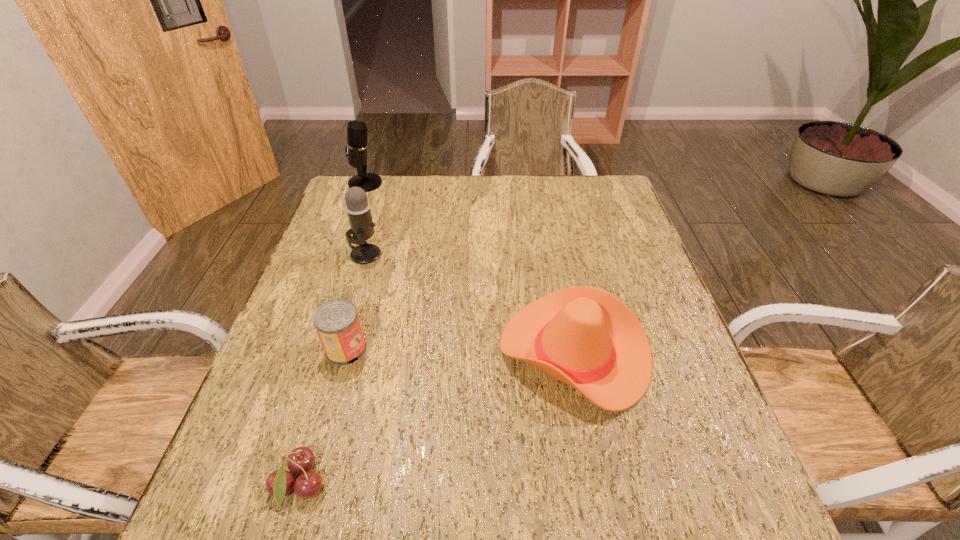
Locate an element on the screen. free region located 0.250m on the front of the can is located at coordinates (309, 483).

Identify the location of vacant region located on the leaves of the nearest object. (526, 485).

Image resolution: width=960 pixels, height=540 pixels. Identify the location of object that is at the far edge. (356, 148).

Locate an element on the screen. The image size is (960, 540). object that is at the near edge is located at coordinates (279, 483).

Locate an element on the screen. can positioned at the left edge is located at coordinates (337, 323).

Find the location of a particular element. cherry that is at the left edge is located at coordinates [279, 483].

The image size is (960, 540). What are the coordinates of `object that is at the right edge` in the screenshot? It's located at point(583,336).

The height and width of the screenshot is (540, 960). I want to click on object at the far left corner, so click(356, 148).

This screenshot has width=960, height=540. Identify the location of object that is positioned at the near left corner. (279, 483).

Where is `vacant space at the far edge of the desktop`? vacant space at the far edge of the desktop is located at coordinates (545, 215).